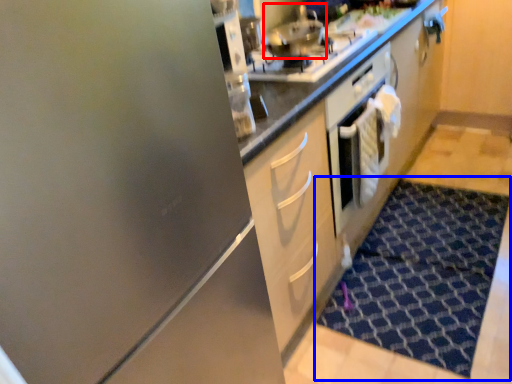
Question: Which object is further to the camera taking this photo, stainless steel (highlighted by a red box) or doormat (highlighted by a blue box)?

Choices:
 (A) stainless steel
 (B) doormat

Answer: (A)